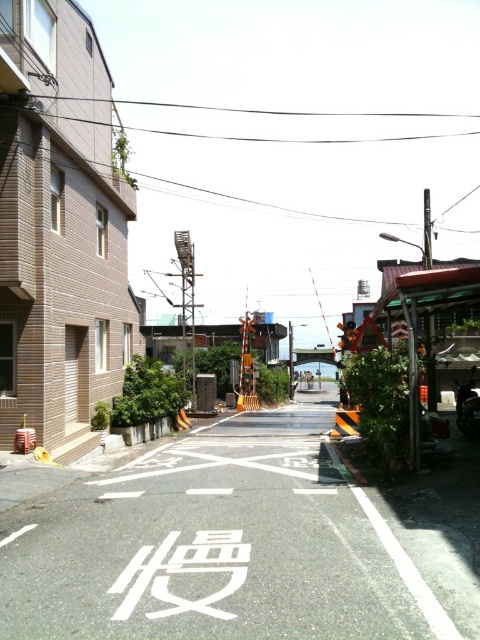
Question: Can you confirm if white asphalt bike lane at center is positioned to the right of black plastic traffic light at center?

Choices:
 (A) yes
 (B) no

Answer: (B)

Question: Which point is closer to the camera?

Choices:
 (A) (420, 493)
 (B) (344, 337)

Answer: (A)

Question: Where is white asphalt bike lane at center located in relation to black plastic traffic light at center in the image?

Choices:
 (A) above
 (B) below

Answer: (B)

Question: Is white asphalt bike lane at center below black plastic traffic light at center?

Choices:
 (A) yes
 (B) no

Answer: (A)

Question: Among these objects, which one is farthest from the camera?

Choices:
 (A) white asphalt bike lane at center
 (B) black plastic traffic light at center

Answer: (B)